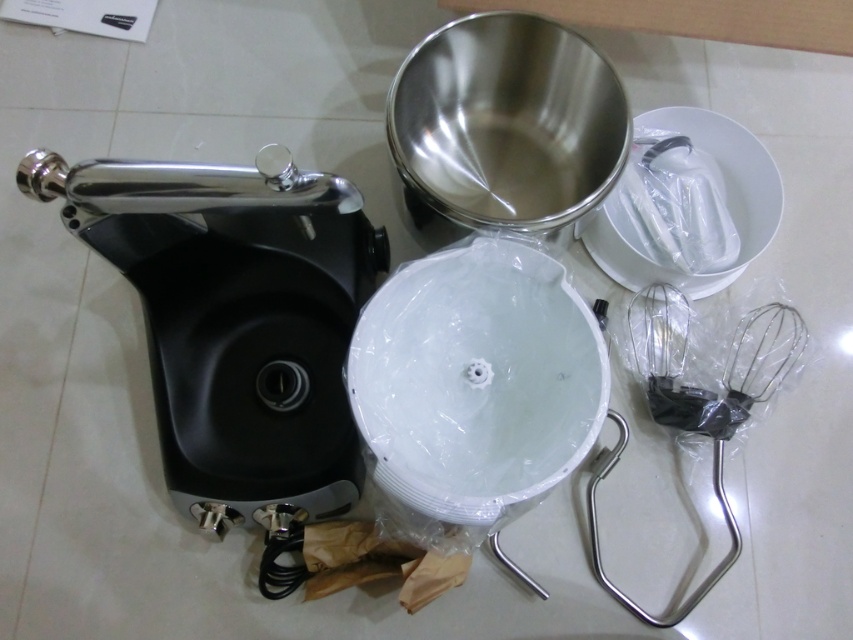
Question: Where is polished metal stand mixer at left located in relation to white plastic sink at center in the image?

Choices:
 (A) below
 (B) above

Answer: (B)

Question: Does silver metallic whisk at lower right have a larger size compared to white plastic basin at center?

Choices:
 (A) no
 (B) yes

Answer: (B)

Question: Among these points, which one is farthest from the camera?

Choices:
 (A) (560, 198)
 (B) (773, 392)
 (C) (177, 381)
 (D) (640, 269)

Answer: (A)

Question: Which of the following is the closest to the observer?

Choices:
 (A) (659, 394)
 (B) (714, 280)

Answer: (A)

Question: Can you confirm if stainless steel mixing bowl at upper center is thinner than silver metallic whisk at lower right?

Choices:
 (A) yes
 (B) no

Answer: (A)

Question: Which of the following is the closest to the observer?

Choices:
 (A) white plastic sink at center
 (B) stainless steel mixing bowl at upper center

Answer: (A)